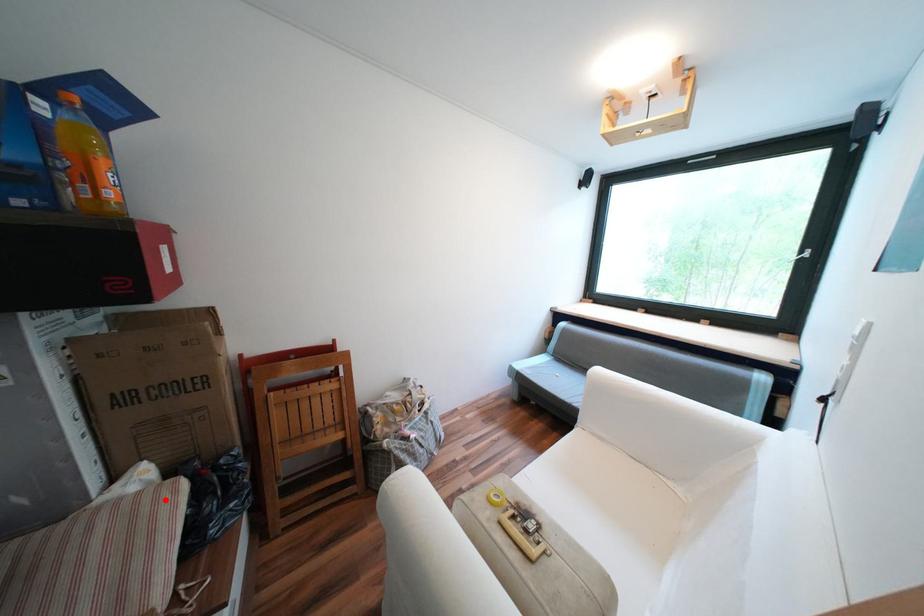
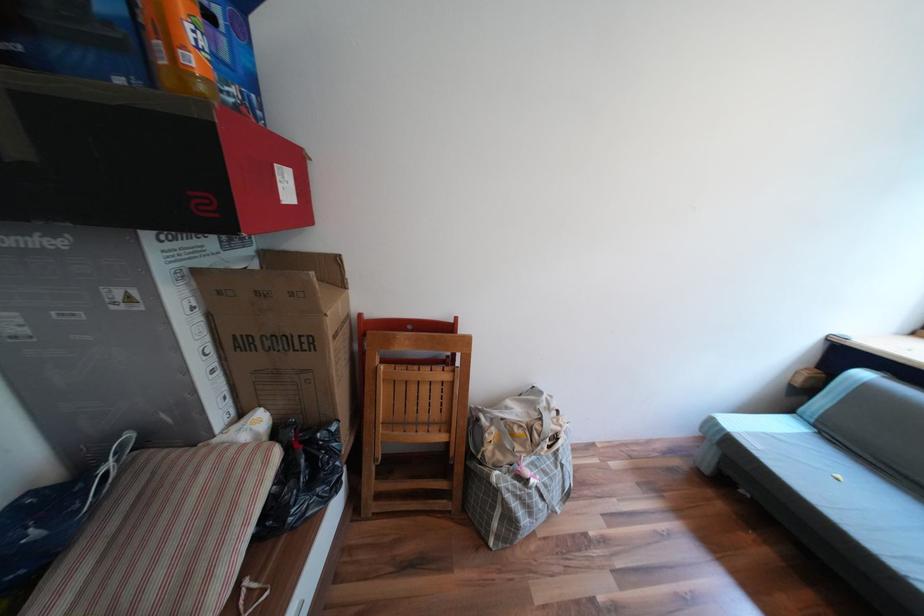
In the second image, find the point that corresponds to the highlighted location in the first image.

(258, 464)